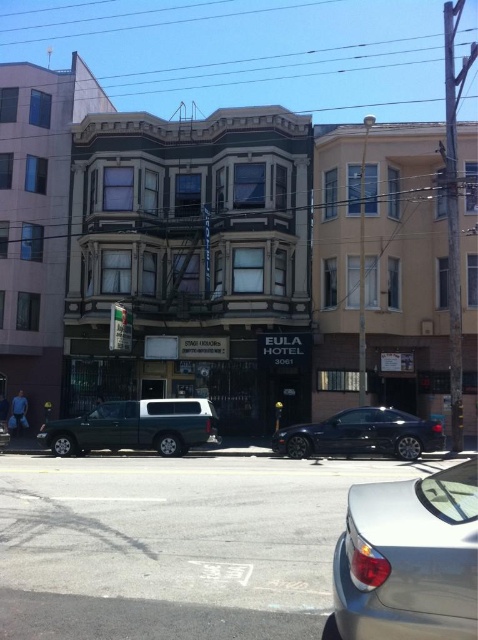
Between satin silver sedan at lower right and shiny dark blue car at center, which one has less height?

satin silver sedan at lower right is shorter.

Is the position of satin silver sedan at lower right less distant than that of shiny dark blue car at center?

That is True.

Which is behind, point (380, 566) or point (325, 440)?

Point (325, 440)

The height and width of the screenshot is (640, 478). What are the coordinates of `satin silver sedan at lower right` in the screenshot? It's located at (410, 557).

Between gray asphalt road at lower center and satin silver sedan at lower right, which one appears on the left side from the viewer's perspective?

Positioned to the left is gray asphalt road at lower center.

Is point (152, 556) positioned in front of point (354, 513)?

No.

Locate an element on the screen. This screenshot has width=478, height=640. gray asphalt road at lower center is located at coordinates (173, 545).

How distant is green matte truck at center from shiny dark blue car at center?

They are 3.42 meters apart.

Does green matte truck at center have a greater height compared to shiny dark blue car at center?

Correct, green matte truck at center is much taller as shiny dark blue car at center.

Is point (175, 428) positioned behind point (330, 417)?

No, it is in front of (330, 417).

Find the location of a particular element. This screenshot has width=478, height=640. green matte truck at center is located at coordinates (134, 428).